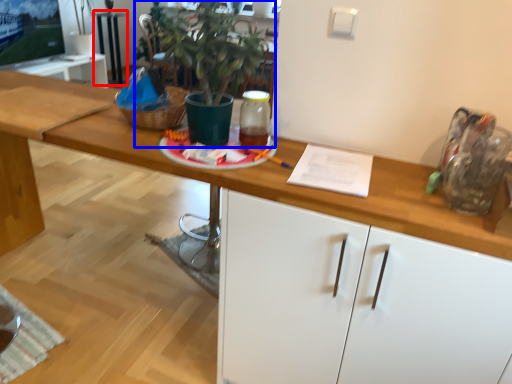
Question: Among these objects, which one is farthest to the camera, table (highlighted by a red box) or houseplant (highlighted by a blue box)?

Choices:
 (A) table
 (B) houseplant

Answer: (A)